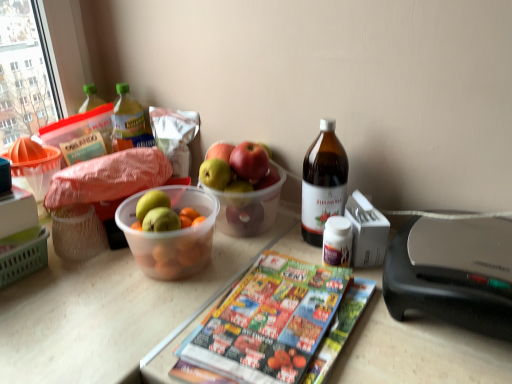
This screenshot has height=384, width=512. Describe the element at coordinates (323, 182) in the screenshot. I see `brown glass bottle at upper right, the first bottle when ordered from right to left` at that location.

I want to click on translucent plastic bottle at upper left, which ranks as the second bottle in bottom-to-top order, so click(x=129, y=122).

The height and width of the screenshot is (384, 512). Find the location of `printed paper magazine at center`. printed paper magazine at center is located at coordinates (273, 319).

Does translucent plastic bottle at upper left, the 1th bottle in the top-to-bottom sequence, have a greater width compared to brown glass bottle at upper right, the first bottle when ordered from right to left?

No.

From the image's perspective, is translucent plastic bottle at upper left, which ranks as the second bottle in bottom-to-top order, on top of brown glass bottle at upper right, which ranks as the 1th bottle in front-to-back order?

Yes, from the image's perspective, translucent plastic bottle at upper left, which ranks as the second bottle in bottom-to-top order, is above brown glass bottle at upper right, which ranks as the 1th bottle in front-to-back order.

Is translucent plastic bottle at upper left, which is the first bottle in back-to-front order, turned away from brown glass bottle at upper right, the second bottle viewed from the left?

That's not correct — translucent plastic bottle at upper left, which is the first bottle in back-to-front order, is not looking away from brown glass bottle at upper right, the second bottle viewed from the left.

Considering the relative positions of translucent plastic bottle at upper left, which is the second bottle from front to back, and brown glass bottle at upper right, the second bottle viewed from the top, in the image provided, is translucent plastic bottle at upper left, which is the second bottle from front to back, to the left of brown glass bottle at upper right, the second bottle viewed from the top, from the viewer's perspective?

Indeed, translucent plastic bottle at upper left, which is the second bottle from front to back, is positioned on the left side of brown glass bottle at upper right, the second bottle viewed from the top.

Is printed paper magazine at center oriented away from green matte grapefruit at center?

printed paper magazine at center does not have its back to green matte grapefruit at center.

Is printed paper magazine at center not near green matte grapefruit at center?

No, there isn't a large distance between printed paper magazine at center and green matte grapefruit at center.

In the scene shown: Considering the sizes of objects printed paper magazine at center and green matte grapefruit at center in the image provided, who is smaller, printed paper magazine at center or green matte grapefruit at center?

With smaller size is printed paper magazine at center.

What's the angular difference between printed paper magazine at center and green matte grapefruit at center's facing directions?

They differ by 88.2 degrees in their facing directions.

Is green matte grapefruit at center oriented towards brown glass bottle at upper right, the second bottle viewed from the top?

Yes, green matte grapefruit at center faces towards brown glass bottle at upper right, the second bottle viewed from the top.

From a real-world perspective, which bottle is the 1st one above the green matte grapefruit at center? Please provide its 2D coordinates.

[(323, 182)]

Which object is further away from the camera taking this photo, green matte grapefruit at center or brown glass bottle at upper right, the second bottle positioned from the back?

green matte grapefruit at center is further away from the camera.

In the scene shown: Can you confirm if printed paper magazine at center is thinner than brown glass bottle at upper right, the second bottle viewed from the left?

No.

From a real-world perspective, which object stands above the other?

brown glass bottle at upper right, the second bottle viewed from the top.

Is printed paper magazine at center far from brown glass bottle at upper right, the second bottle viewed from the left?

That's not correct — printed paper magazine at center is a little close to brown glass bottle at upper right, the second bottle viewed from the left.

Considering the positions of points (268, 270) and (309, 153), is point (268, 270) closer to camera compared to point (309, 153)?

That is True.

Considering the sizes of objects brown glass bottle at upper right, which is the 1th bottle in bottom-to-top order, and translucent plastic bottle at upper left, which ranks as the second bottle in bottom-to-top order, in the image provided, who is thinner, brown glass bottle at upper right, which is the 1th bottle in bottom-to-top order, or translucent plastic bottle at upper left, which ranks as the second bottle in bottom-to-top order,?

translucent plastic bottle at upper left, which ranks as the second bottle in bottom-to-top order.

Is brown glass bottle at upper right, the second bottle viewed from the left, facing away from translucent plastic bottle at upper left, the second bottle positioned from the right?

No, brown glass bottle at upper right, the second bottle viewed from the left, is not facing away from translucent plastic bottle at upper left, the second bottle positioned from the right.

Choose the correct answer: Is brown glass bottle at upper right, the second bottle viewed from the left, inside translucent plastic bottle at upper left, which is the first bottle from left to right, or outside it?

A: brown glass bottle at upper right, the second bottle viewed from the left, cannot be found inside translucent plastic bottle at upper left, which is the first bottle from left to right.

Is green matte grapefruit at center situated inside translucent plastic bottle at upper left, which ranks as the second bottle in bottom-to-top order, or outside?

green matte grapefruit at center cannot be found inside translucent plastic bottle at upper left, which ranks as the second bottle in bottom-to-top order.

From a real-world perspective, which object stands above the other?

translucent plastic bottle at upper left, which is the second bottle from front to back, from a real-world perspective.

Is green matte grapefruit at center bigger or smaller than translucent plastic bottle at upper left, which ranks as the second bottle in bottom-to-top order?

Clearly, green matte grapefruit at center is larger in size than translucent plastic bottle at upper left, which ranks as the second bottle in bottom-to-top order.

Does brown glass bottle at upper right, the first bottle when ordered from right to left, lie behind printed paper magazine at center?

Yes, brown glass bottle at upper right, the first bottle when ordered from right to left, is further from the camera.

Considering the relative positions of brown glass bottle at upper right, the first bottle when ordered from right to left, and printed paper magazine at center in the image provided, is brown glass bottle at upper right, the first bottle when ordered from right to left, to the right of printed paper magazine at center from the viewer's perspective?

Indeed, brown glass bottle at upper right, the first bottle when ordered from right to left, is positioned on the right side of printed paper magazine at center.

Looking at this image, are brown glass bottle at upper right, which ranks as the 1th bottle in front-to-back order, and printed paper magazine at center making contact?

They are not placed beside each other.

Could you tell me if brown glass bottle at upper right, the second bottle positioned from the back, is facing printed paper magazine at center?

Yes, brown glass bottle at upper right, the second bottle positioned from the back, faces towards printed paper magazine at center.

This screenshot has height=384, width=512. I want to click on bottle located above the brown glass bottle at upper right, the second bottle positioned from the back (from a real-world perspective), so click(129, 122).

Find the location of a particular element. This screenshot has width=512, height=384. grapefruit that appears above the printed paper magazine at center (from the image's perspective) is located at coordinates (247, 208).

Estimate the real-world distances between objects in this image. Which object is closer to translucent plastic bottle at upper left, the 1th bottle in the top-to-bottom sequence, brown glass bottle at upper right, which is the 1th bottle in bottom-to-top order, or green matte grapefruit at center?

green matte grapefruit at center.

Which object lies further to the anchor point printed paper magazine at center, green matte grapefruit at center or brown glass bottle at upper right, the second bottle positioned from the back?

green matte grapefruit at center lies further to printed paper magazine at center than the other object.

From the picture: Estimate the real-world distances between objects in this image. Which object is closer to translucent plastic bottle at upper left, the second bottle positioned from the right, green matte grapefruit at center or brown glass bottle at upper right, the second bottle viewed from the top?

green matte grapefruit at center is closer to translucent plastic bottle at upper left, the second bottle positioned from the right.

Considering their positions, is translucent plastic bottle at upper left, which is the second bottle from front to back, positioned closer to green matte grapefruit at center than brown glass bottle at upper right, the first bottle when ordered from right to left?

brown glass bottle at upper right, the first bottle when ordered from right to left, lies closer to green matte grapefruit at center than the other object.

When comparing their distances from brown glass bottle at upper right, the second bottle positioned from the back, does translucent plastic bottle at upper left, which is the second bottle from front to back, or green matte grapefruit at center seem closer?

green matte grapefruit at center is closer to brown glass bottle at upper right, the second bottle positioned from the back.

Which object lies nearer to the anchor point printed paper magazine at center, brown glass bottle at upper right, the first bottle when ordered from right to left, or translucent plastic bottle at upper left, which is the first bottle in back-to-front order?

Based on the image, brown glass bottle at upper right, the first bottle when ordered from right to left, appears to be nearer to printed paper magazine at center.

Based on the photo, based on their spatial positions, is printed paper magazine at center or green matte grapefruit at center closer to brown glass bottle at upper right, the second bottle viewed from the left?

green matte grapefruit at center is positioned closer to the anchor brown glass bottle at upper right, the second bottle viewed from the left.

Looking at the image, which one is located closer to green matte grapefruit at center, printed paper magazine at center or translucent plastic bottle at upper left, which ranks as the second bottle in bottom-to-top order?

printed paper magazine at center.

Find the location of a particular element. grapefruit situated between translucent plastic bottle at upper left, which ranks as the second bottle in bottom-to-top order, and brown glass bottle at upper right, which is the 1th bottle in bottom-to-top order, from left to right is located at coordinates (247, 208).

I want to click on bottle positioned between printed paper magazine at center and green matte grapefruit at center from near to far, so tap(323, 182).

Where is `bottle positioned between printed paper magazine at center and translucent plastic bottle at upper left, which is the first bottle in back-to-front order, from near to far`? bottle positioned between printed paper magazine at center and translucent plastic bottle at upper left, which is the first bottle in back-to-front order, from near to far is located at coordinates (323, 182).

Identify the location of grapefruit positioned between printed paper magazine at center and translucent plastic bottle at upper left, which is the second bottle from front to back, from near to far. The image size is (512, 384). (247, 208).